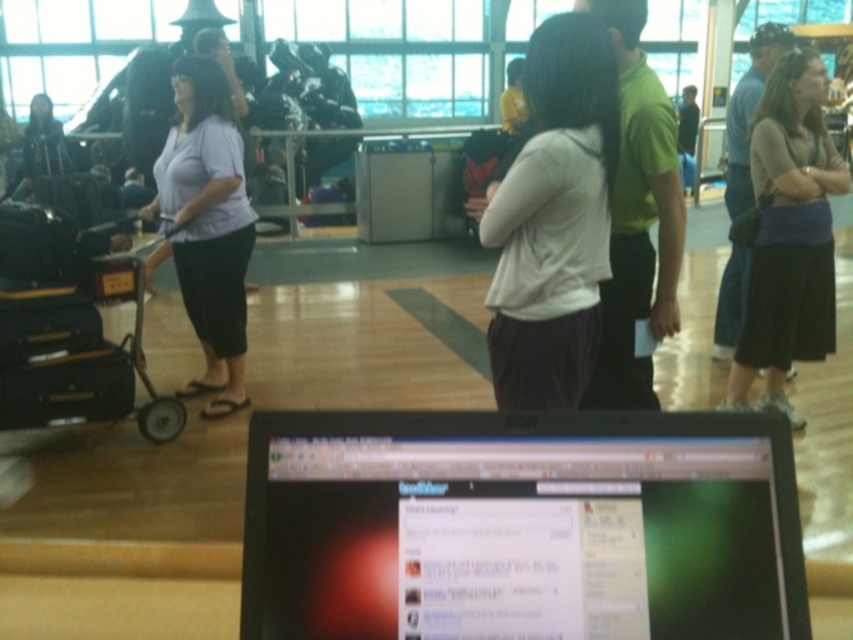
Looking at this image, you are a traveler trying to decide which item is wider between the dark brown skirt at right and the black plastic cart at left in the airport scene. Based on the description, which one has a greater width?

The dark brown skirt at right has a greater width than the black plastic cart at left according to the description.

You are a traveler who just arrived at the airport and need to check your flight details on the black glossy laptop at center. However, your black hard suitcase at left is blocking your view of the laptop screen. Can you see the laptop screen clearly without moving the suitcase?

The black glossy laptop at center is closer to the viewer than the black hard suitcase at left, so you can see the laptop screen clearly without moving the suitcase because it is in front of the suitcase.

You are a traveler trying to check flight information on your black glossy laptop at center. There is a person wearing a white matte shirt at center standing next to you. Can you see the laptop screen clearly without obstruction?

The black glossy laptop at center is wider than the white matte shirt at center, so you can see the laptop screen clearly without obstruction.